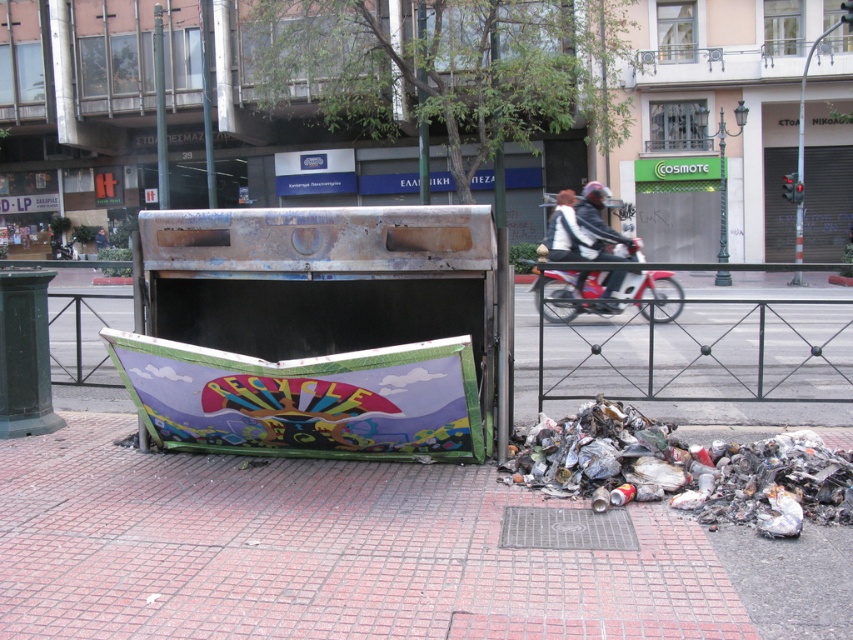
From the picture: Is the position of brick pavement at lower left less distant than that of metallic red motorcycle at center?

Yes.

Does brick pavement at lower left have a lesser height compared to metallic red motorcycle at center?

Yes.

Who is more distant from viewer, [569,621] or [657,305]?

Positioned behind is point [657,305].

I want to click on brick pavement at lower left, so click(364, 554).

Which of these two, brick pavement at lower left or shiny metallic cans at lower right, stands taller?

shiny metallic cans at lower right is taller.

Can you confirm if brick pavement at lower left is taller than shiny metallic cans at lower right?

In fact, brick pavement at lower left may be shorter than shiny metallic cans at lower right.

Who is more distant from viewer, (415, 618) or (766, 467)?

Point (766, 467)

Identify the location of brick pavement at lower left. (364, 554).

Is shiny metallic cans at lower right positioned before white leather jacket at center?

Yes, shiny metallic cans at lower right is closer to the viewer.

Consider the image. Can you confirm if shiny metallic cans at lower right is positioned below white leather jacket at center?

Yes.

Measure the distance between shiny metallic cans at lower right and camera.

The distance of shiny metallic cans at lower right from camera is 16.23 feet.

Locate an element on the screen. The image size is (853, 640). shiny metallic cans at lower right is located at coordinates (685, 468).